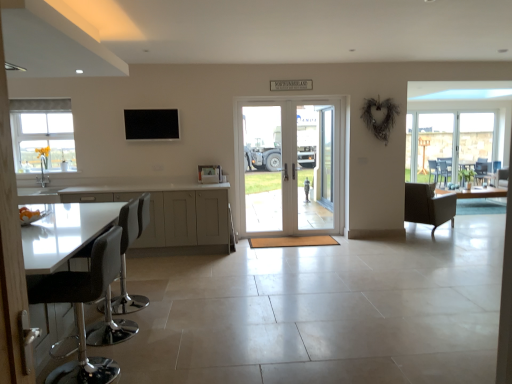
Question: Is white glossy cabinets at lower left smaller than white glossy door at center?

Choices:
 (A) yes
 (B) no

Answer: (B)

Question: Considering the relative positions of white glossy cabinets at lower left and white glossy door at center in the image provided, is white glossy cabinets at lower left behind white glossy door at center?

Choices:
 (A) no
 (B) yes

Answer: (A)

Question: Is white glossy cabinets at lower left turned away from white glossy door at center?

Choices:
 (A) no
 (B) yes

Answer: (A)

Question: From the image's perspective, is white glossy cabinets at lower left above white glossy door at center?

Choices:
 (A) yes
 (B) no

Answer: (B)

Question: From a real-world perspective, is white glossy cabinets at lower left physically below white glossy door at center?

Choices:
 (A) no
 (B) yes

Answer: (B)

Question: In the image, is black matte tv at upper center positioned in front of or behind clear glass door at center, which is the second screen door from right to left?

Choices:
 (A) front
 (B) behind

Answer: (A)

Question: Considering the positions of black matte tv at upper center and clear glass door at center, which is the second screen door from right to left, in the image, is black matte tv at upper center taller or shorter than clear glass door at center, which is the second screen door from right to left,?

Choices:
 (A) short
 (B) tall

Answer: (A)

Question: Is point (140, 130) positioned closer to the camera than point (267, 109)?

Choices:
 (A) farther
 (B) closer

Answer: (B)

Question: From a real-world perspective, is black matte tv at upper center physically located above or below clear glass door at center, which is the second screen door from right to left?

Choices:
 (A) above
 (B) below

Answer: (A)

Question: In terms of height, does black leather stool at lower left, arranged as the first chair when viewed from the front, look taller or shorter compared to clear glass door at center, the first screen door in the left-to-right sequence?

Choices:
 (A) tall
 (B) short

Answer: (B)

Question: Is black leather stool at lower left, arranged as the first chair when viewed from the front, inside the boundaries of clear glass door at center, which is the second screen door from right to left, or outside?

Choices:
 (A) outside
 (B) inside

Answer: (A)

Question: From a real-world perspective, relative to clear glass door at center, the first screen door in the left-to-right sequence, is black leather stool at lower left, marked as the second chair in a right-to-left arrangement, vertically above or below?

Choices:
 (A) below
 (B) above

Answer: (A)

Question: In the image, is black leather stool at lower left, arranged as the 2th chair when viewed from the left, positioned in front of or behind clear glass door at center, which is the second screen door from right to left?

Choices:
 (A) front
 (B) behind

Answer: (A)

Question: Would you say clear glass door at center, which is the second screen door from right to left, is inside or outside white glossy cabinets at lower left?

Choices:
 (A) inside
 (B) outside

Answer: (B)

Question: Visually, is clear glass door at center, the first screen door in the left-to-right sequence, positioned to the left or to the right of white glossy cabinets at lower left?

Choices:
 (A) right
 (B) left

Answer: (A)